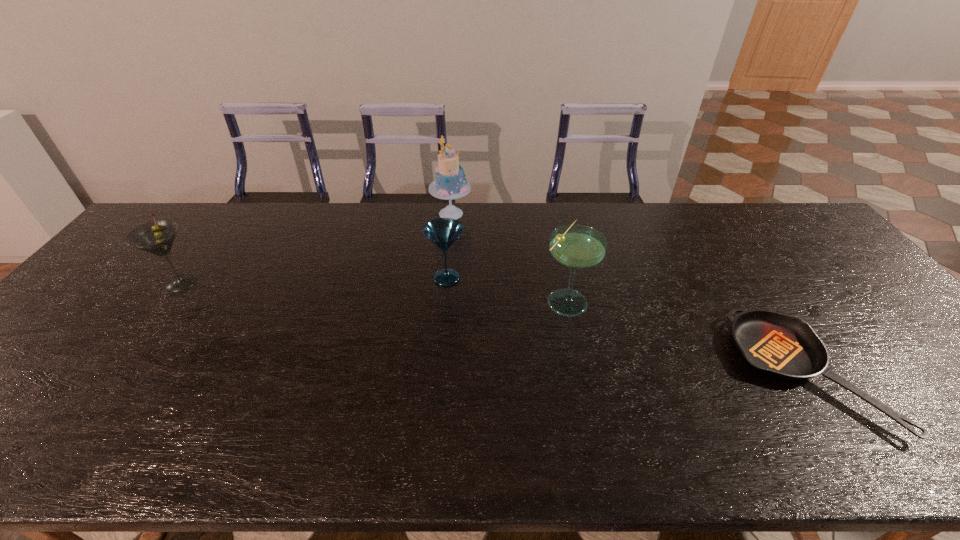
The width and height of the screenshot is (960, 540). What are the coordinates of `vacant space located on the front of the leftmost object` in the screenshot? It's located at (155, 319).

The width and height of the screenshot is (960, 540). I want to click on free location located 0.190m on the back of the second martini from left to right, so point(450,228).

Find the location of `free space located on the back of the rightmost object`. free space located on the back of the rightmost object is located at coordinates (742, 279).

The width and height of the screenshot is (960, 540). Identify the location of object positioned at the far edge. (450, 183).

What are the coordinates of `object present at the near edge` in the screenshot? It's located at (783, 346).

The image size is (960, 540). Identify the location of free space at the far edge. (347, 230).

The height and width of the screenshot is (540, 960). In the image, there is a desktop. Find the location of `vacant space at the near edge`. vacant space at the near edge is located at coordinates (208, 430).

You are a GUI agent. You are given a task and a screenshot of the screen. Output one action in this format:
    pyautogui.click(x=<x>, y=<y>)
    Task: Click on the free space at the left edge of the desktop
    This screenshot has height=540, width=960.
    Given the screenshot: What is the action you would take?
    pyautogui.click(x=95, y=300)

Where is `vacant space at the right edge of the desktop`? Image resolution: width=960 pixels, height=540 pixels. vacant space at the right edge of the desktop is located at coordinates (876, 328).

In the image, there is a desktop. What are the coordinates of `vacant region at the far left corner` in the screenshot? It's located at (171, 216).